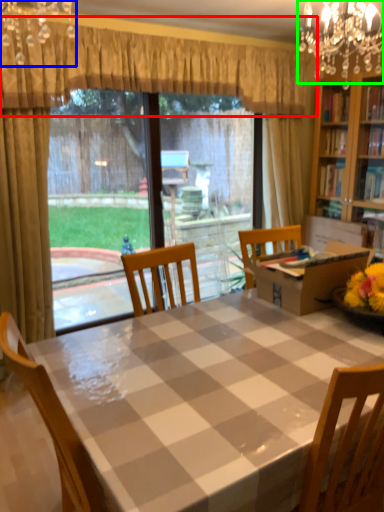
Question: Based on their relative distances, which object is nearer to curtain (highlighted by a red box)? Choose from light fixture (highlighted by a blue box) and light fixture (highlighted by a green box).

Choices:
 (A) light fixture
 (B) light fixture

Answer: (A)